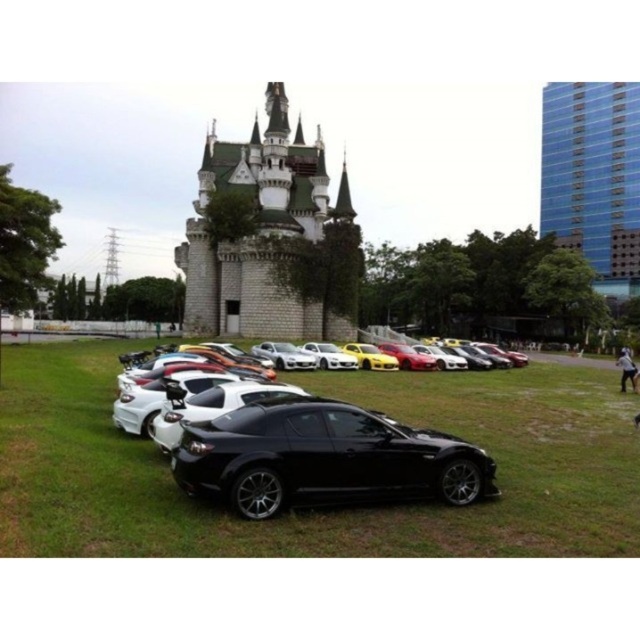
You are a photographer planning to take a picture of the blue glass building at upper right and the white glossy sports car at center. Which object should you focus on first if you want to capture both in a single frame without moving the camera?

You should focus on the white glossy sports car at center first because the blue glass building at upper right is taller than it, so adjusting focus from closer to farther would be more efficient.

You are standing at the origin point of the coordinate system in the image. You want to walk to the green grass at center. What are the coordinates you need to move to?

The coordinates you need to move to are approximately 0.795 in the x direction and 0.497 in the y direction, which corresponds to the position of the green grass at center.

You are a drone operator who needs to fly a drone from the green stone castle at center to the blue glass building at upper right. What is the approximate distance you need to cover?

The green stone castle at center is 282.05 feet from the blue glass building at upper right, so the drone needs to cover approximately 282 feet.